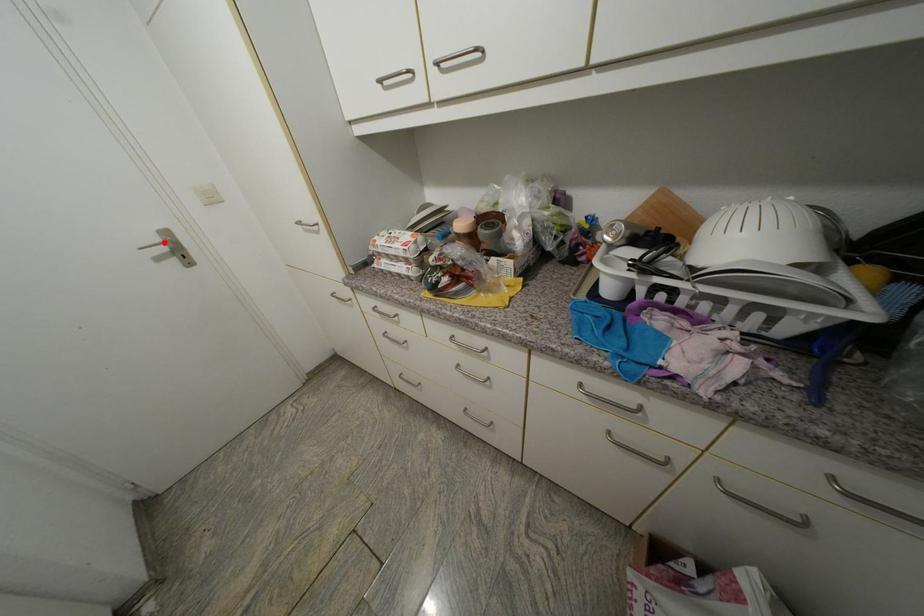
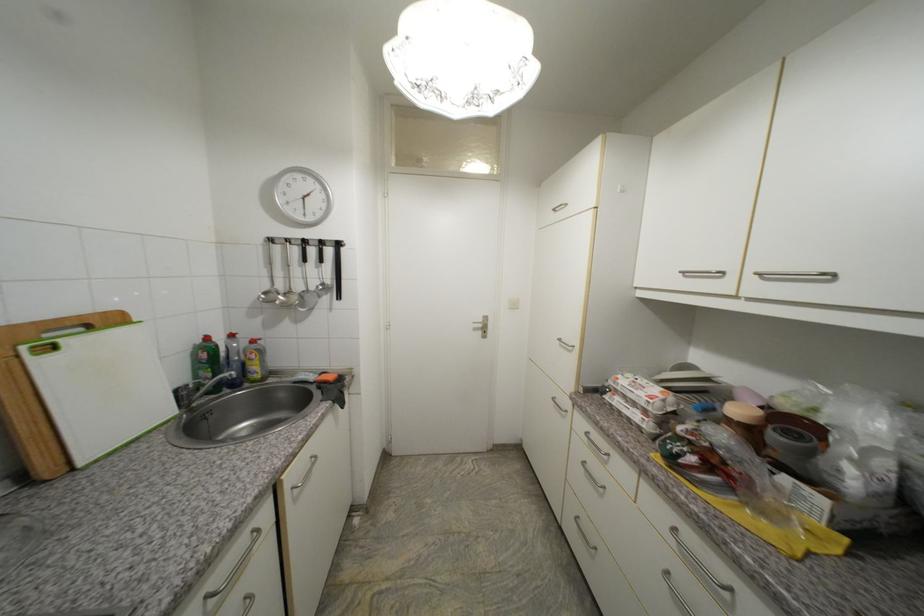
Find the pixel in the second image that matches the highlighted location in the first image.

(487, 322)